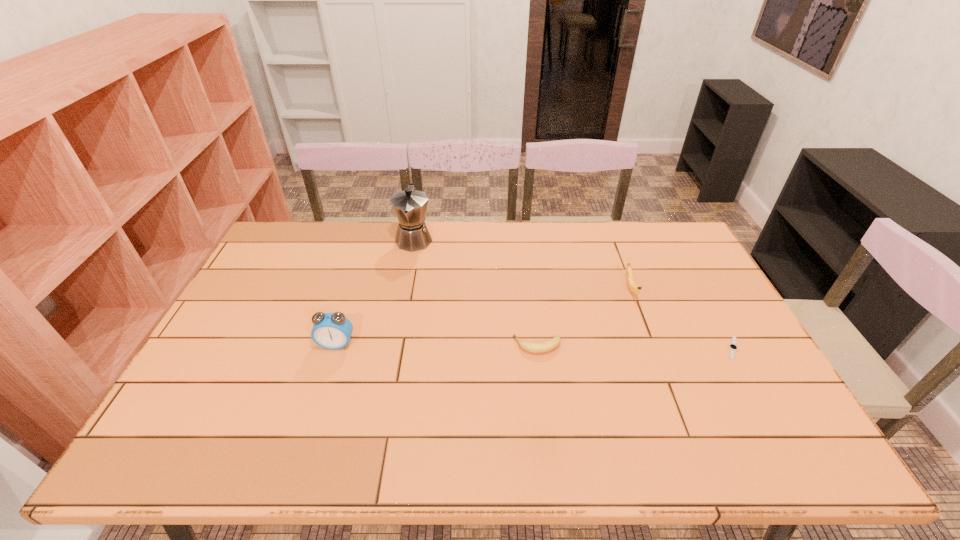
Find the location of `free location that satisfies the following two spatial constraints: 1. at the spout of the coffeepot; 2. on the left side of the watch`. free location that satisfies the following two spatial constraints: 1. at the spout of the coffeepot; 2. on the left side of the watch is located at coordinates (394, 348).